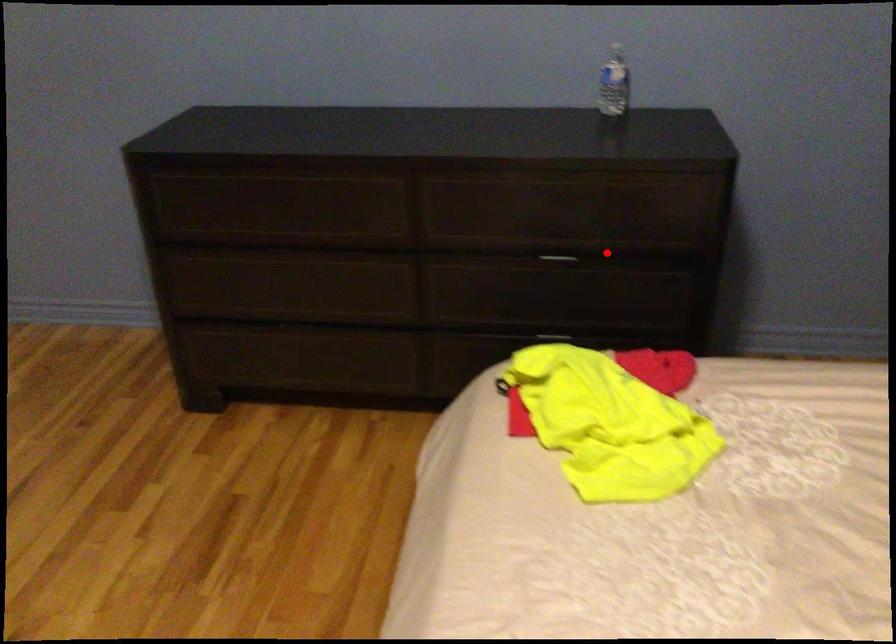
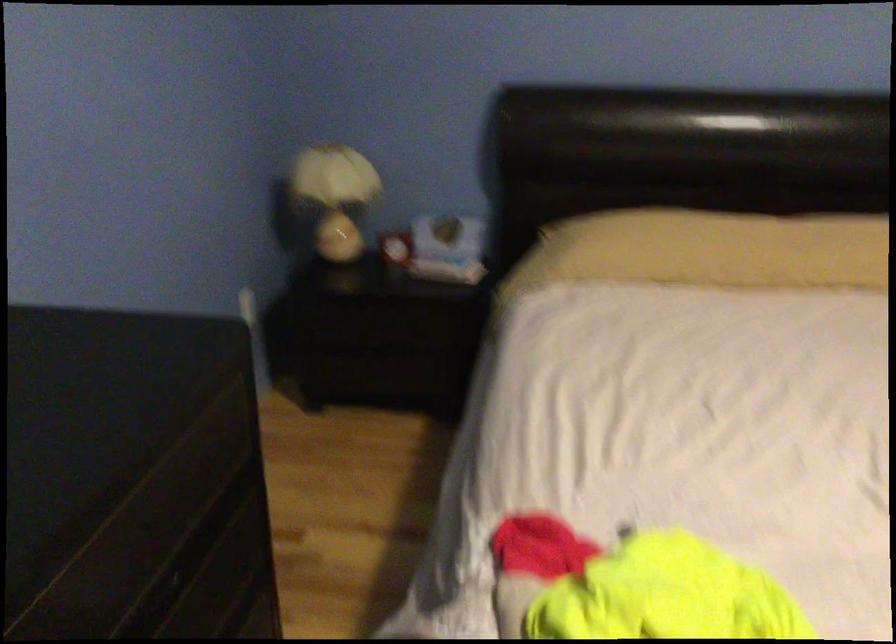
Question: A red point is marked in image1. In image2, is the corresponding 3D point closer to the camera or farther? Reply with the corresponding letter.

Choices:
 (A) The corresponding 3D point is closer.
 (B) The corresponding 3D point is farther.

Answer: (A)